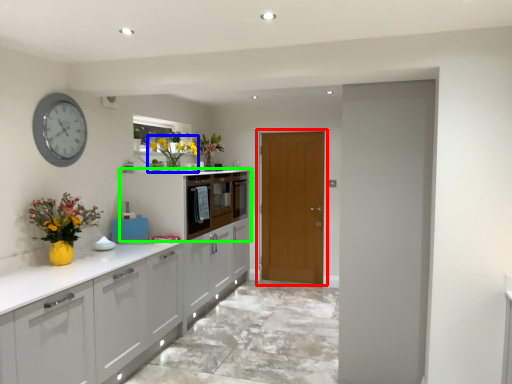
Question: Which object is the closest to the door (highlighted by a red box)? Choose among these: floral arrangement (highlighted by a blue box) or cabinetry (highlighted by a green box).

Choices:
 (A) floral arrangement
 (B) cabinetry

Answer: (B)